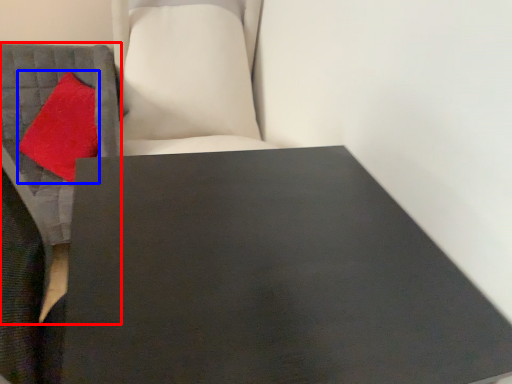
Question: Which point is closer to the camera, furniture (highlighted by a red box) or throw pillow (highlighted by a blue box)?

Choices:
 (A) furniture
 (B) throw pillow

Answer: (A)